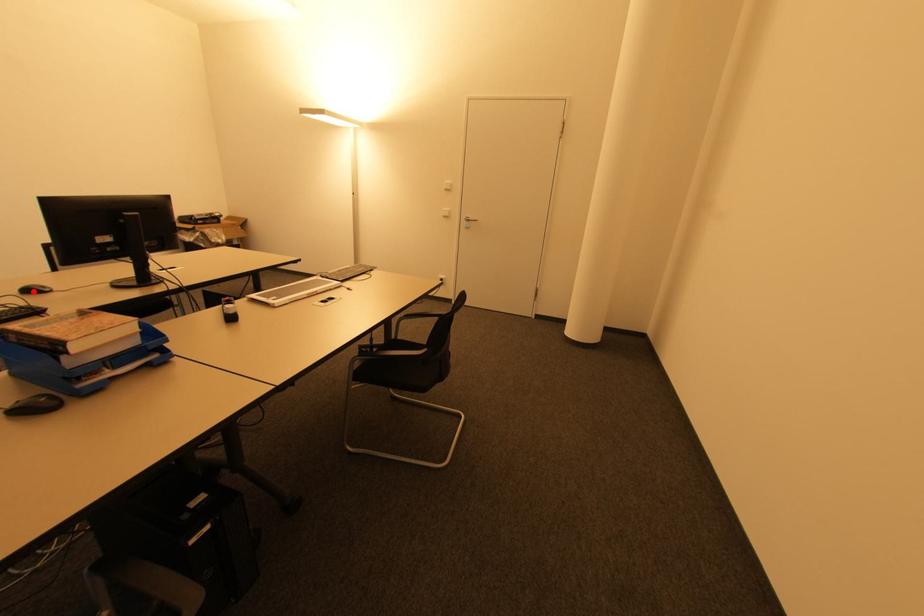
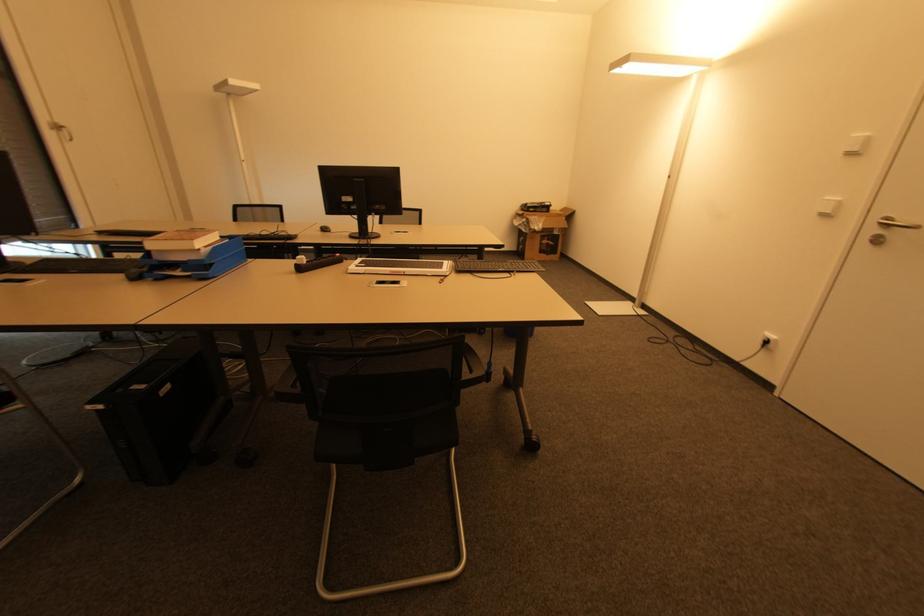
Question: I am providing you with two images of the same scene from different viewpoints. A red point is shown in image1. For the corresponding object point in image2, is it positioned nearer or farther from the camera?

Choices:
 (A) Nearer
 (B) Farther

Answer: (A)